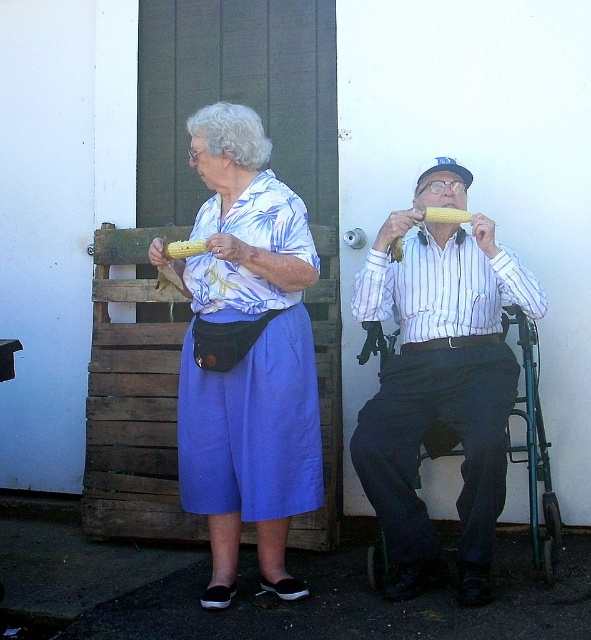
Question: Considering the real-world distances, which object is closest to the yellow corn cob at upper center?

Choices:
 (A) yellow corn at upper center
 (B) matte white shirt at center

Answer: (A)

Question: Is matte white shirt at center further to camera compared to yellow corn cob at upper center?

Choices:
 (A) yes
 (B) no

Answer: (B)

Question: Which point appears closest to the camera in this image?

Choices:
 (A) (165, 252)
 (B) (262, 584)

Answer: (A)

Question: Which point is closer to the camera?

Choices:
 (A) click(x=297, y=353)
 (B) click(x=446, y=224)

Answer: (A)

Question: Does white striped shirt at center appear on the left side of yellow corn cob at upper center?

Choices:
 (A) yes
 (B) no

Answer: (B)

Question: Is matte blue skirt at center positioned behind matte white shirt at center?

Choices:
 (A) yes
 (B) no

Answer: (A)